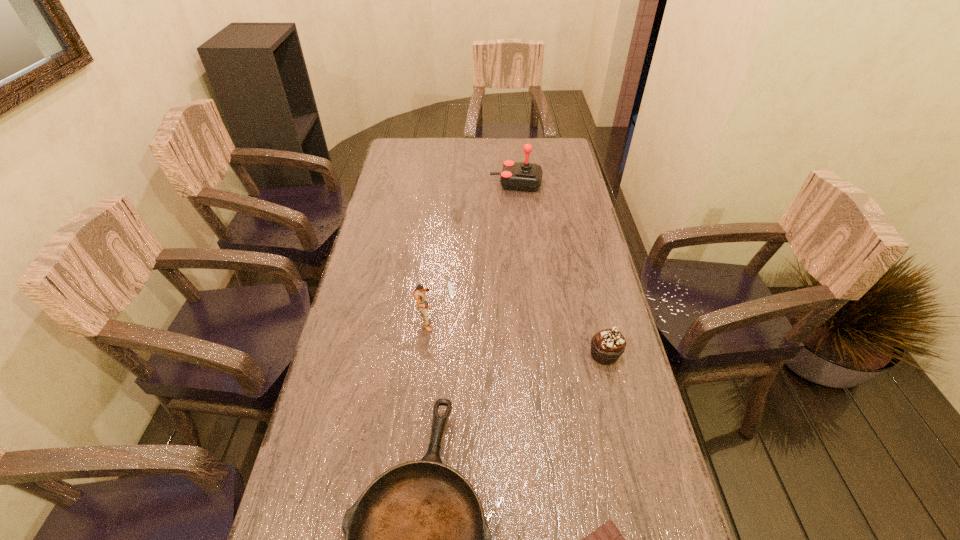
Identify the location of joystick. (524, 176).

Where is `the farthest object`? The height and width of the screenshot is (540, 960). the farthest object is located at coordinates (524, 176).

Identify the location of the fourth shortest object. (422, 304).

What are the coordinates of `puncher` in the screenshot? It's located at (422, 304).

This screenshot has height=540, width=960. Find the location of `cupcake`. cupcake is located at coordinates (608, 345).

At what (x,y) coordinates should I click in order to perform the action: click on the third nearest object. Please return your answer as a coordinate pair (x, y). This screenshot has height=540, width=960. Looking at the image, I should click on (608, 345).

Image resolution: width=960 pixels, height=540 pixels. What are the coordinates of `vacant region located on the left of the tallest object` in the screenshot? It's located at (459, 184).

Where is `vacant space located 0.120m on the front-facing side of the second tallest object`? vacant space located 0.120m on the front-facing side of the second tallest object is located at coordinates (478, 319).

Where is `vacant space located 0.390m on the back of the third farthest object`? The height and width of the screenshot is (540, 960). vacant space located 0.390m on the back of the third farthest object is located at coordinates (579, 246).

Where is `joystick present at the right edge`? The width and height of the screenshot is (960, 540). joystick present at the right edge is located at coordinates (524, 176).